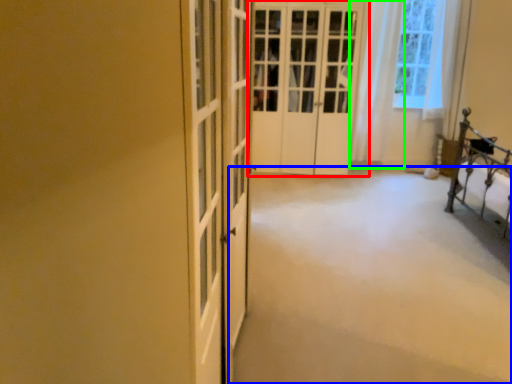
Question: Based on their relative distances, which object is nearer to door (highlighted by a red box)? Choose from plain (highlighted by a blue box) and curtain (highlighted by a green box).

Choices:
 (A) plain
 (B) curtain

Answer: (B)